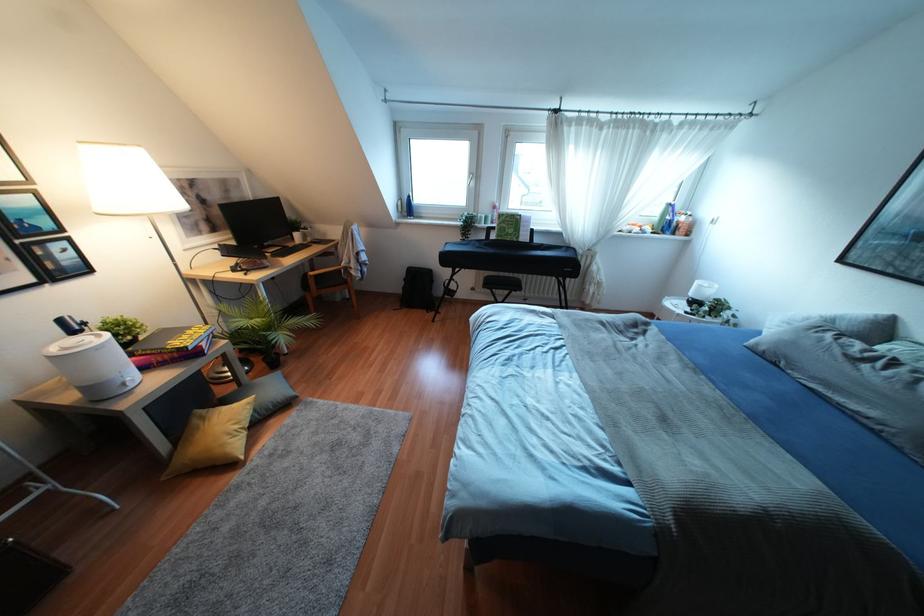
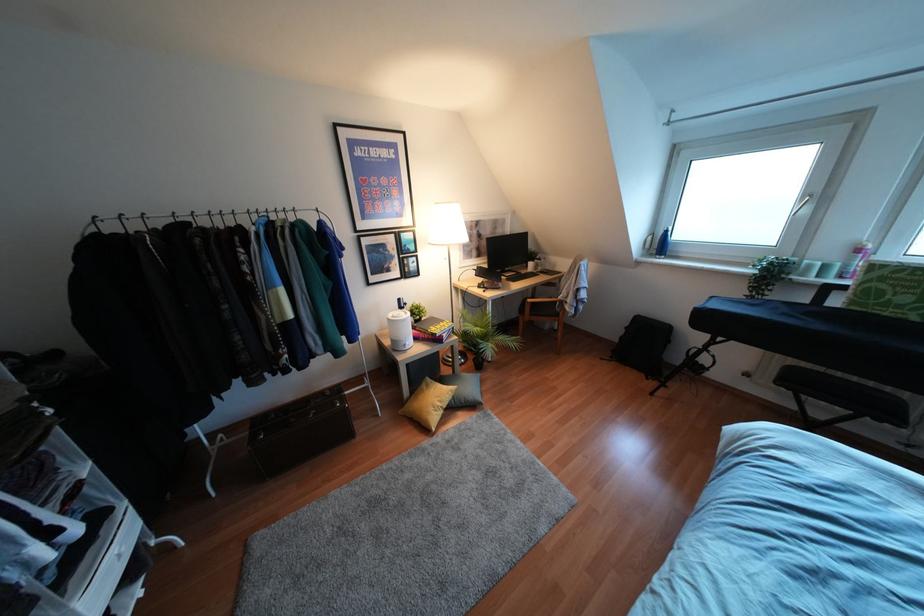
In the second image, find the point that corresponds to pixel 493 207 in the first image.

(858, 249)